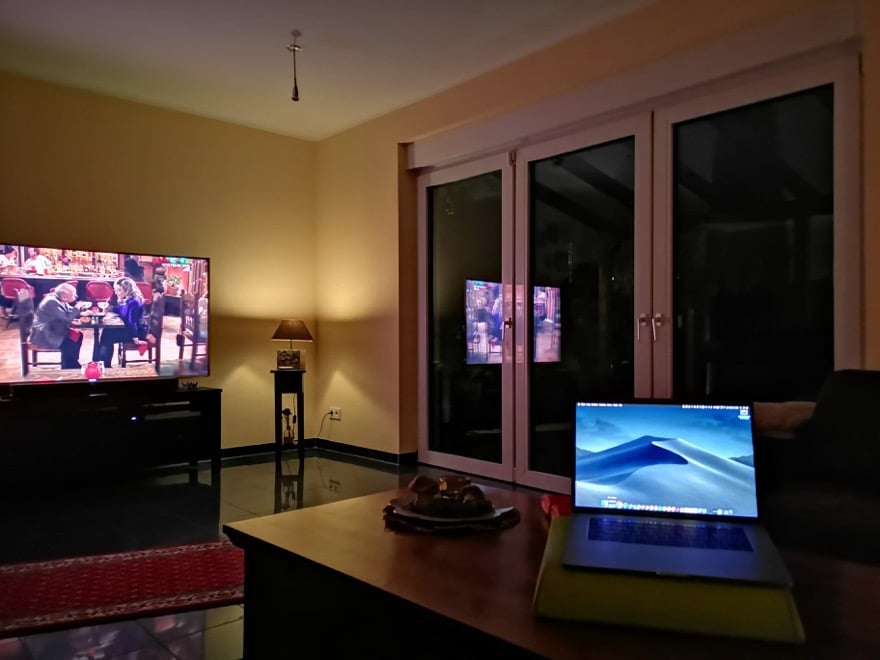
Find the location of a particular element. door is located at coordinates (655, 312).